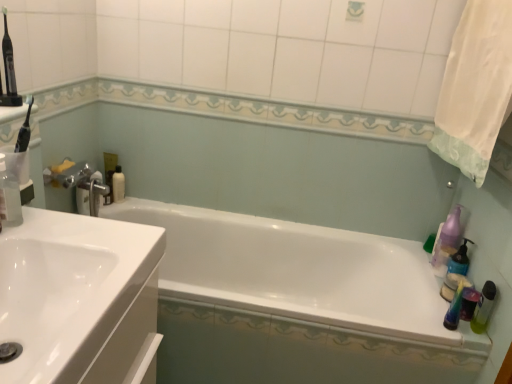
Locate an element on the screen. The height and width of the screenshot is (384, 512). translucent plastic mouthwash at right, the first mouthwash in the front-to-back sequence is located at coordinates (455, 302).

From the image's perspective, is translucent plastic mouthwash at right, marked as the first mouthwash in a right-to-left arrangement, under translucent plastic pump bottle at right, arranged as the 2th cleaning product when viewed from the left?

Correct, translucent plastic mouthwash at right, marked as the first mouthwash in a right-to-left arrangement, appears lower than translucent plastic pump bottle at right, arranged as the 2th cleaning product when viewed from the left, in the image.

Is translucent plastic mouthwash at right, the first mouthwash in the front-to-back sequence, aimed at translucent plastic pump bottle at right, which is counted as the second cleaning product, starting from the front?

No.

In the scene shown: Does translucent plastic mouthwash at right, acting as the second mouthwash starting from the top, have a smaller size compared to translucent plastic pump bottle at right, which is counted as the second cleaning product, starting from the front?

Correct, translucent plastic mouthwash at right, acting as the second mouthwash starting from the top, occupies less space than translucent plastic pump bottle at right, which is counted as the second cleaning product, starting from the front.

Who is shorter, translucent plastic mouthwash at right, acting as the second mouthwash starting from the top, or transparent plastic bottle at left, the 3th cleaning product viewed from the back?

translucent plastic mouthwash at right, acting as the second mouthwash starting from the top.

From a real-world perspective, between translucent plastic mouthwash at right, the second mouthwash from the back, and transparent plastic bottle at left, the 3th cleaning product viewed from the back, who is vertically lower?

translucent plastic mouthwash at right, the second mouthwash from the back, from a real-world perspective.

From the picture: How different are the orientations of translucent plastic mouthwash at right, acting as the second mouthwash starting from the top, and transparent plastic bottle at left, the 3th cleaning product viewed from the back, in degrees?

There is a 180-degree angle between the facing directions of translucent plastic mouthwash at right, acting as the second mouthwash starting from the top, and transparent plastic bottle at left, the 3th cleaning product viewed from the back.

Can you confirm if translucent plastic mouthwash at right, acting as the second mouthwash starting from the top, is smaller than transparent plastic bottle at left, the 1th cleaning product when ordered from left to right?

Indeed, translucent plastic mouthwash at right, acting as the second mouthwash starting from the top, has a smaller size compared to transparent plastic bottle at left, the 1th cleaning product when ordered from left to right.

Which is behind, point (17, 181) or point (493, 64)?

The point (493, 64) is more distant.

Is transparent plastic bottle at left, the 1th cleaning product positioned from the front, positioned with its back to white fabric shower curtain at upper right?

No, white fabric shower curtain at upper right is not at the back of transparent plastic bottle at left, the 1th cleaning product positioned from the front.

From the image's perspective, is transparent plastic bottle at left, the 1th cleaning product positioned from the front, under white fabric shower curtain at upper right?

Indeed, from the image's perspective, transparent plastic bottle at left, the 1th cleaning product positioned from the front, is shown beneath white fabric shower curtain at upper right.

Is the depth of transparent plastic bottle at left, the 3th cleaning product viewed from the back, greater than that of white fabric shower curtain at upper right?

No, it is not.

Does point (455, 228) appear closer or farther from the camera than point (457, 263)?

Point (455, 228).

Looking at this image, is purple translucent soap dispenser at right, positioned as the third cleaning product in left-to-right order, not within translucent plastic pump bottle at right, acting as the 2th cleaning product starting from the back?

purple translucent soap dispenser at right, positioned as the third cleaning product in left-to-right order, is positioned outside translucent plastic pump bottle at right, acting as the 2th cleaning product starting from the back.

Does purple translucent soap dispenser at right, which is the 1th cleaning product in right-to-left order, have a larger size compared to translucent plastic pump bottle at right, acting as the 2th cleaning product starting from the back?

Correct, purple translucent soap dispenser at right, which is the 1th cleaning product in right-to-left order, is larger in size than translucent plastic pump bottle at right, acting as the 2th cleaning product starting from the back.

In the image, is purple translucent soap dispenser at right, which ranks as the first cleaning product in back-to-front order, on the left side or the right side of translucent plastic pump bottle at right, which is the second cleaning product in right-to-left order?

purple translucent soap dispenser at right, which ranks as the first cleaning product in back-to-front order, is positioned on translucent plastic pump bottle at right, which is the second cleaning product in right-to-left order,'s right side.

Can you tell me how much white glossy bathtub at center and white glossy sink at left differ in facing direction?

They differ by 91 degrees in their facing directions.

Is white glossy bathtub at center oriented towards white glossy sink at left?

No, white glossy bathtub at center does not turn towards white glossy sink at left.

Considering the sizes of objects white glossy bathtub at center and white glossy sink at left in the image provided, who is smaller, white glossy bathtub at center or white glossy sink at left?

Smaller between the two is white glossy sink at left.

Can you confirm if white glossy bathtub at center is shorter than white glossy sink at left?

Incorrect, the height of white glossy bathtub at center does not fall short of that of white glossy sink at left.

How many degrees apart are the facing directions of white glossy bathtub at center and translucent plastic pump bottle at right, which is counted as the second cleaning product, starting from the front?

The facing directions of white glossy bathtub at center and translucent plastic pump bottle at right, which is counted as the second cleaning product, starting from the front, are 90 degrees apart.

Would you say white glossy bathtub at center is outside translucent plastic pump bottle at right, which is counted as the second cleaning product, starting from the front?

Yes, white glossy bathtub at center is located beyond the bounds of translucent plastic pump bottle at right, which is counted as the second cleaning product, starting from the front.

Considering the relative sizes of white glossy bathtub at center and translucent plastic pump bottle at right, which is the second cleaning product in right-to-left order, in the image provided, is white glossy bathtub at center smaller than translucent plastic pump bottle at right, which is the second cleaning product in right-to-left order,?

Incorrect, white glossy bathtub at center is not smaller in size than translucent plastic pump bottle at right, which is the second cleaning product in right-to-left order.

Which object is closer to the camera, white glossy bathtub at center or translucent plastic pump bottle at right, which is the second cleaning product in right-to-left order?

Positioned in front is white glossy bathtub at center.

Does translucent plastic mouthwash at right, which is counted as the first mouthwash, starting from the bottom, have a greater width compared to white glossy bottle at upper left, the 1th mouthwash from the left?

Incorrect, the width of translucent plastic mouthwash at right, which is counted as the first mouthwash, starting from the bottom, does not surpass that of white glossy bottle at upper left, the 1th mouthwash from the left.

From the image's perspective, is translucent plastic mouthwash at right, marked as the first mouthwash in a right-to-left arrangement, under white glossy bottle at upper left, arranged as the second mouthwash when viewed from the front?

Yes, from the image's perspective, translucent plastic mouthwash at right, marked as the first mouthwash in a right-to-left arrangement, is below white glossy bottle at upper left, arranged as the second mouthwash when viewed from the front.

Which is behind, point (450, 322) or point (122, 191)?

The point (122, 191) is more distant.

Is translucent plastic mouthwash at right, the first mouthwash in the front-to-back sequence, far away from white glossy bottle at upper left, the first mouthwash in the top-to-bottom sequence?

Yes, translucent plastic mouthwash at right, the first mouthwash in the front-to-back sequence, and white glossy bottle at upper left, the first mouthwash in the top-to-bottom sequence, are quite far apart.

You are a GUI agent. You are given a task and a screenshot of the screen. Output one action in this format:
    pyautogui.click(x=<x>, y=<y>)
    Task: Click on the 1st mouthwash to the left when counting from the translucent plastic pump bottle at right, which is counted as the second cleaning product, starting from the front
    The image size is (512, 384).
    Given the screenshot: What is the action you would take?
    (x=455, y=302)

Locate an element on the screen. The height and width of the screenshot is (384, 512). mouthwash on the right of transparent plastic bottle at left, which ranks as the third cleaning product in right-to-left order is located at coordinates (455, 302).

Estimate the real-world distances between objects in this image. Which object is closer to translucent plastic pump bottle at right, which is the second cleaning product in right-to-left order, white glossy bottle at upper left, the first mouthwash in the top-to-bottom sequence, or transparent plastic bottle at left, which ranks as the third cleaning product in right-to-left order?

transparent plastic bottle at left, which ranks as the third cleaning product in right-to-left order, lies closer to translucent plastic pump bottle at right, which is the second cleaning product in right-to-left order, than the other object.

Based on their spatial positions, is translucent plastic bottle at right or purple translucent soap dispenser at right, which is the third cleaning product from front to back, closer to white fabric shower curtain at upper right?

purple translucent soap dispenser at right, which is the third cleaning product from front to back, lies closer to white fabric shower curtain at upper right than the other object.

Which object lies further to the anchor point white glossy bathtub at center, transparent plastic bottle at left, which ranks as the third cleaning product in right-to-left order, or translucent plastic pump bottle at right, which is the second cleaning product in right-to-left order?

The object further to white glossy bathtub at center is transparent plastic bottle at left, which ranks as the third cleaning product in right-to-left order.

Estimate the real-world distances between objects in this image. Which object is closer to white glossy bathtub at center, white fabric shower curtain at upper right or translucent plastic pump bottle at right, which is the second cleaning product in right-to-left order?

translucent plastic pump bottle at right, which is the second cleaning product in right-to-left order.

Considering their positions, is translucent plastic bottle at right positioned closer to purple translucent soap dispenser at right, which is the 1th cleaning product in right-to-left order, than white fabric shower curtain at upper right?

Among the two, translucent plastic bottle at right is located nearer to purple translucent soap dispenser at right, which is the 1th cleaning product in right-to-left order.

Looking at this image, considering their positions, is translucent plastic mouthwash at right, which is counted as the first mouthwash, starting from the bottom, positioned further to white fabric shower curtain at upper right than white glossy bathtub at center?

white glossy bathtub at center.

Which object lies further to the anchor point white glossy bottle at upper left, placed as the first mouthwash when sorted from back to front, white glossy sink at left or white fabric shower curtain at upper right?

Based on the image, white fabric shower curtain at upper right appears to be further to white glossy bottle at upper left, placed as the first mouthwash when sorted from back to front.

Estimate the real-world distances between objects in this image. Which object is further from white glossy bathtub at center, purple translucent soap dispenser at right, which ranks as the first cleaning product in back-to-front order, or translucent plastic bottle at right?

The object further to white glossy bathtub at center is translucent plastic bottle at right.

Locate an element on the screen. Image resolution: width=512 pixels, height=384 pixels. cleaning product between white glossy sink at left and purple translucent soap dispenser at right, which ranks as the first cleaning product in back-to-front order, from left to right is located at coordinates pyautogui.click(x=455, y=271).

Locate an element on the screen. Image resolution: width=512 pixels, height=384 pixels. bottle located between white glossy bottle at upper left, arranged as the second mouthwash when viewed from the front, and translucent plastic pump bottle at right, arranged as the 2th cleaning product when viewed from the left, in the left-right direction is located at coordinates (484, 308).

Locate an element on the screen. The width and height of the screenshot is (512, 384). shower curtain between white glossy bottle at upper left, the 2th mouthwash viewed from the right, and purple translucent soap dispenser at right, which is the 1th cleaning product in right-to-left order, from left to right is located at coordinates (475, 88).

At what (x,y) coordinates should I click in order to perform the action: click on mouthwash between transparent plastic bottle at left, which ranks as the third cleaning product in right-to-left order, and translucent plastic pump bottle at right, arranged as the 2th cleaning product when viewed from the left, in the horizontal direction. Please return your answer as a coordinate pair (x, y). Looking at the image, I should click on (455, 302).